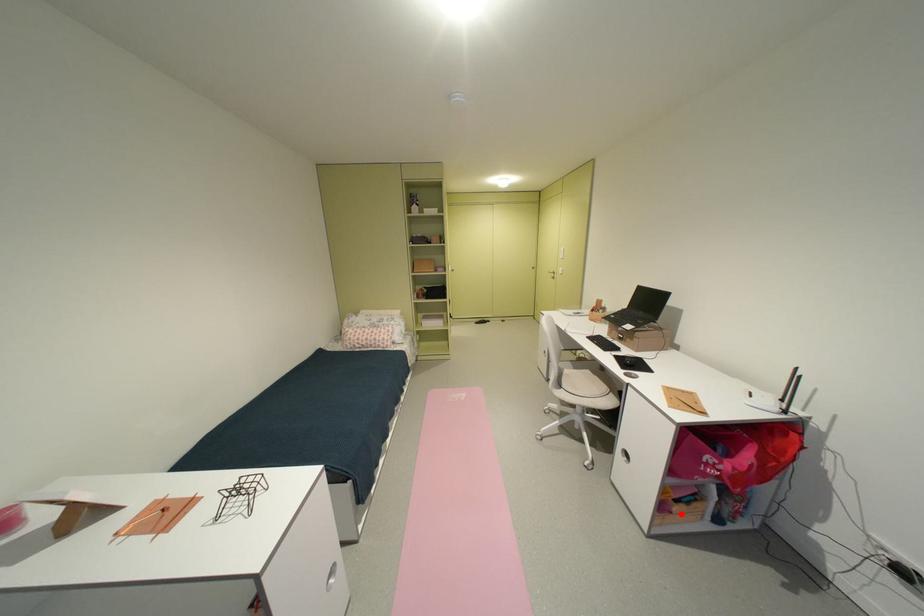
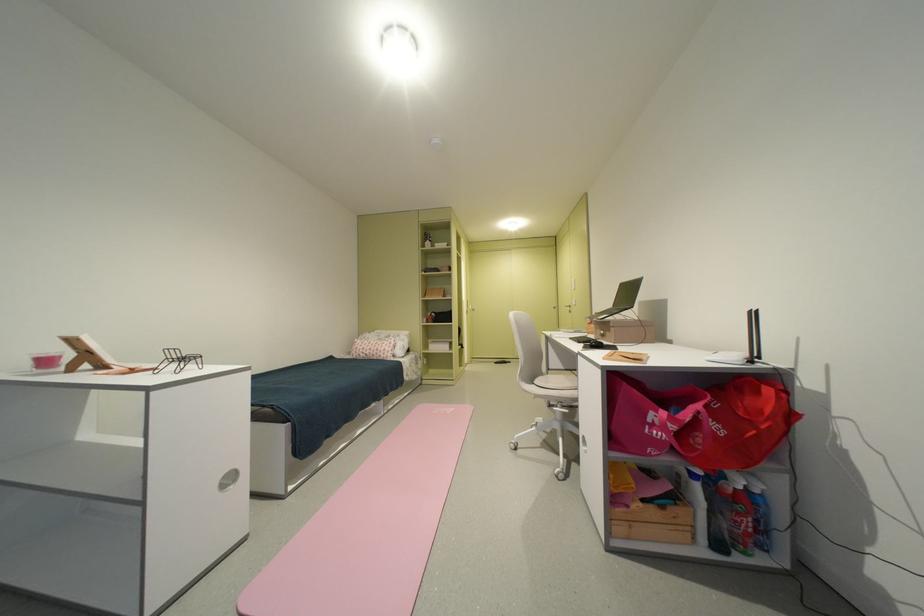
Find the pixel in the second image that matches the highlighted location in the first image.

(638, 508)